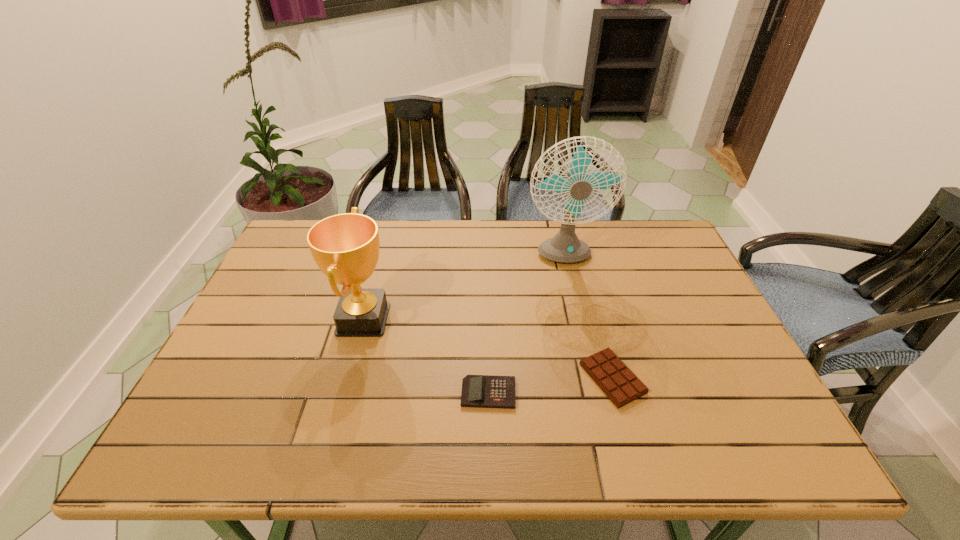
Where is `unoccupied position between the candy bar and the second object from left to right`? unoccupied position between the candy bar and the second object from left to right is located at coordinates (550, 386).

At what (x,y) coordinates should I click in order to perform the action: click on vacant space in between the calculator and the candy bar. Please return your answer as a coordinate pair (x, y). Looking at the image, I should click on (550, 386).

Where is `empty space between the second object from left to right and the candy bar`? Image resolution: width=960 pixels, height=540 pixels. empty space between the second object from left to right and the candy bar is located at coordinates (550, 386).

Locate an element on the screen. This screenshot has width=960, height=540. free area in between the candy bar and the second object from left to right is located at coordinates (550, 386).

Where is `free space between the calculator and the tallest object`? This screenshot has width=960, height=540. free space between the calculator and the tallest object is located at coordinates 525,326.

In order to click on free point between the third shortest object and the candy bar in this screenshot , I will do `click(488, 349)`.

This screenshot has width=960, height=540. Identify the location of vacant area that lies between the tallest object and the leftmost object. (463, 289).

The height and width of the screenshot is (540, 960). Identify the location of object that is the closest to the tallest object. (614, 378).

You are a GUI agent. You are given a task and a screenshot of the screen. Output one action in this format:
    pyautogui.click(x=<x>, y=<y>)
    Task: Click on the closest object to the tallest object
    The width and height of the screenshot is (960, 540).
    Given the screenshot: What is the action you would take?
    pyautogui.click(x=614, y=378)

At what (x,y) coordinates should I click in order to perform the action: click on vacant space that satisfies the following two spatial constraints: 1. on the front-facing side of the candy bar; 2. on the right side of the leftmost object. Please return your answer as a coordinate pair (x, y). Looking at the image, I should click on (348, 378).